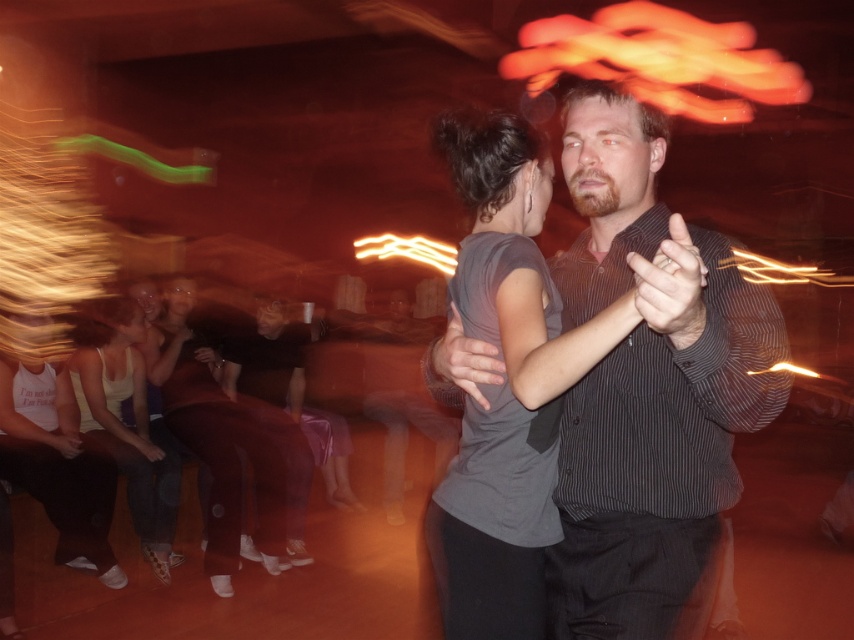
Does point (147, 499) come farther from viewer compared to point (390, 456)?

No.

Does denim jeans at lower left have a greater height compared to dark gray striped shirt at center?

Correct, denim jeans at lower left is much taller as dark gray striped shirt at center.

Between point (115, 301) and point (395, 404), which one is positioned behind?

Point (395, 404)

Image resolution: width=854 pixels, height=640 pixels. Find the location of `denim jeans at lower left`. denim jeans at lower left is located at coordinates (130, 432).

Can you confirm if denim jeans at lower left is positioned above dark brown leather jacket at lower left?

No.

Which is below, denim jeans at lower left or dark brown leather jacket at lower left?

denim jeans at lower left is lower down.

I want to click on denim jeans at lower left, so click(x=130, y=432).

Can you confirm if striped button-up shirt at center is thinner than dark gray striped shirt at center?

Yes.

Consider the image. Is striped button-up shirt at center shorter than dark gray striped shirt at center?

Yes, striped button-up shirt at center is shorter than dark gray striped shirt at center.

Does point (609, 476) come in front of point (452, 445)?

Yes, it is in front of point (452, 445).

The image size is (854, 640). Identify the location of striped button-up shirt at center. (648, 388).